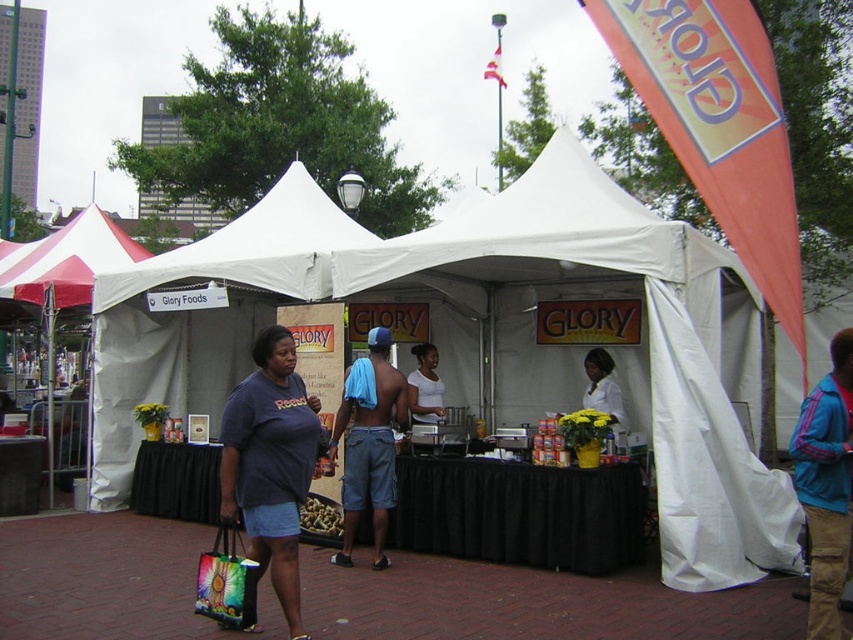
Which is more to the right, matte blue t-shirt at center or blue towel at center?

blue towel at center

Is point (305, 484) farther from viewer compared to point (387, 458)?

No, it is in front of (387, 458).

The height and width of the screenshot is (640, 853). What do you see at coordinates (271, 464) in the screenshot?
I see `matte blue t-shirt at center` at bounding box center [271, 464].

This screenshot has height=640, width=853. Identify the location of matte blue t-shirt at center. (271, 464).

Is the position of white fabric tent at center more distant than that of rainbow plastic bag at lower left?

That is True.

Is point (538, 374) positioned after point (229, 540)?

Yes, point (538, 374) is farther from viewer.

Find the location of a particular element. This screenshot has width=853, height=640. white fabric tent at center is located at coordinates (488, 337).

Does white fabric tent at center have a lesser height compared to blue towel at center?

In fact, white fabric tent at center may be taller than blue towel at center.

Which is above, white fabric tent at center or blue towel at center?

white fabric tent at center

Which is in front, point (606, 262) or point (349, 406)?

Point (606, 262) is in front.

Image resolution: width=853 pixels, height=640 pixels. What are the coordinates of `white fabric tent at center` in the screenshot? It's located at (488, 337).